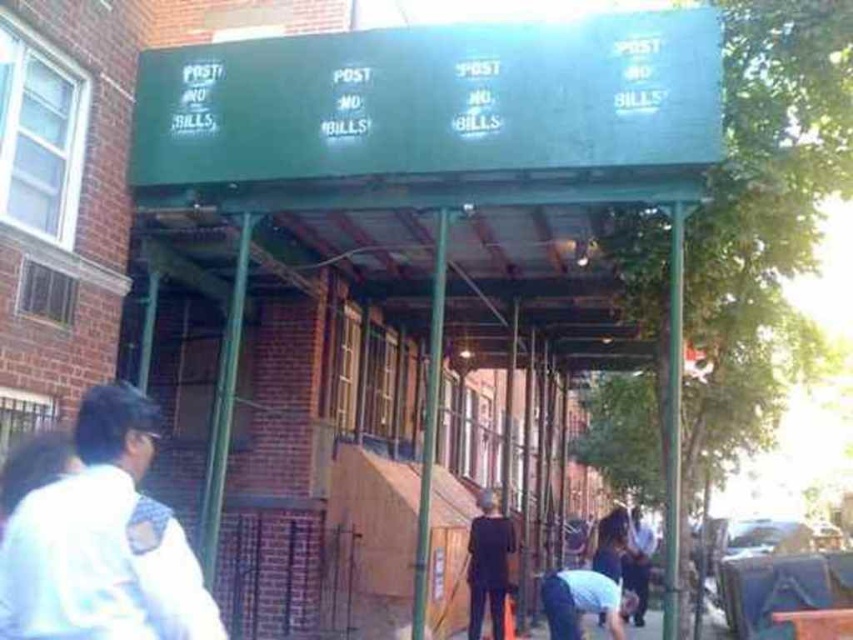
Question: Is green metal awning at upper center bigger than light blue fabric at lower center?

Choices:
 (A) no
 (B) yes

Answer: (B)

Question: Is green matte awning at upper center in front of black matte suit at center?

Choices:
 (A) yes
 (B) no

Answer: (A)

Question: Which of the following is the closest to the observer?

Choices:
 (A) (225, 182)
 (B) (576, 595)

Answer: (A)

Question: Which point is closer to the camera taking this photo?

Choices:
 (A) click(500, 528)
 (B) click(434, 262)
 (C) click(561, 612)
 (D) click(149, 541)

Answer: (D)

Question: Does white fabric backpack at left appear under light blue fabric at lower center?

Choices:
 (A) yes
 (B) no

Answer: (B)

Question: Which is nearer to the green matte awning at upper center?

Choices:
 (A) white fabric backpack at left
 (B) green metal awning at upper center

Answer: (B)